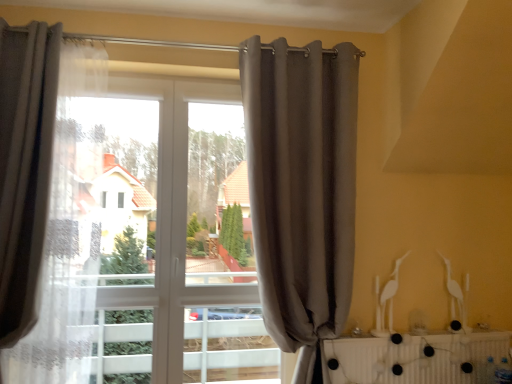
Question: In terms of size, does gray fabric curtain at center, positioned as the first curtain in right-to-left order, appear bigger or smaller than white plastic radiator at lower right?

Choices:
 (A) big
 (B) small

Answer: (A)

Question: Is gray fabric curtain at center, positioned as the first curtain in right-to-left order, taller or shorter than white plastic radiator at lower right?

Choices:
 (A) short
 (B) tall

Answer: (B)

Question: Which is nearer to the white plastic radiator at lower right?

Choices:
 (A) matte gray curtain at left, placed as the first curtain when sorted from left to right
 (B) gray fabric curtain at center, positioned as the first curtain in right-to-left order

Answer: (B)

Question: Estimate the real-world distances between objects in this image. Which object is farther from the gray fabric curtain at center, positioned as the first curtain in right-to-left order?

Choices:
 (A) white plastic radiator at lower right
 (B) matte gray curtain at left, which ranks as the 2th curtain in right-to-left order

Answer: (B)